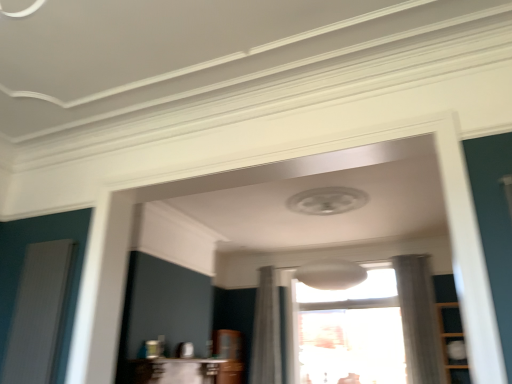
Describe the element at coordinates (419, 319) in the screenshot. This screenshot has width=512, height=384. I see `white sheer curtain at right, arranged as the second curtain when viewed from the left` at that location.

Identify the location of transparent glass window at center. (370, 329).

This screenshot has width=512, height=384. What are the coordinates of `white sheer curtain at center, which ranks as the second curtain in right-to-left order` in the screenshot? It's located at (268, 330).

The height and width of the screenshot is (384, 512). Identify the location of wooden cabinet at right. (453, 343).

Where is `white ribbed screen door at left`? This screenshot has height=384, width=512. white ribbed screen door at left is located at coordinates (38, 314).

The width and height of the screenshot is (512, 384). Describe the element at coordinates (38, 314) in the screenshot. I see `white ribbed screen door at left` at that location.

The image size is (512, 384). Identify the location of white sheer curtain at right, arranged as the second curtain when viewed from the left. (419, 319).

Is white sheer curtain at center, marked as the first curtain in a left-to-right arrangement, at the left side of wooden cabinet at right?

Correct, you'll find white sheer curtain at center, marked as the first curtain in a left-to-right arrangement, to the left of wooden cabinet at right.

Is white sheer curtain at center, which ranks as the second curtain in right-to-left order, directly adjacent to wooden cabinet at right?

There is a gap between white sheer curtain at center, which ranks as the second curtain in right-to-left order, and wooden cabinet at right.

Is white sheer curtain at center, which ranks as the second curtain in right-to-left order, closer to camera compared to wooden cabinet at right?

No, white sheer curtain at center, which ranks as the second curtain in right-to-left order, is further to the viewer.

From a real-world perspective, is white ribbed screen door at left beneath white sheer curtain at right, which is the first curtain in right-to-left order?

Indeed, from a real-world perspective, white ribbed screen door at left is positioned beneath white sheer curtain at right, which is the first curtain in right-to-left order.

Which object is closer to the camera taking this photo, white ribbed screen door at left or white sheer curtain at right, arranged as the second curtain when viewed from the left?

white ribbed screen door at left is more forward.

Is white ribbed screen door at left aimed at white sheer curtain at right, arranged as the second curtain when viewed from the left?

No, white ribbed screen door at left is not aimed at white sheer curtain at right, arranged as the second curtain when viewed from the left.

Is white ribbed screen door at left facing away from white sheer curtain at center, marked as the first curtain in a left-to-right arrangement?

That's right, white ribbed screen door at left is facing away from white sheer curtain at center, marked as the first curtain in a left-to-right arrangement.

Considering the relative positions of white ribbed screen door at left and white sheer curtain at center, which ranks as the second curtain in right-to-left order, in the image provided, is white ribbed screen door at left to the left or to the right of white sheer curtain at center, which ranks as the second curtain in right-to-left order,?

From the image, it's evident that white ribbed screen door at left is to the left of white sheer curtain at center, which ranks as the second curtain in right-to-left order.

From the image's perspective, would you say white ribbed screen door at left is positioned over white sheer curtain at center, marked as the first curtain in a left-to-right arrangement?

Indeed, from the image's perspective, white ribbed screen door at left is shown above white sheer curtain at center, marked as the first curtain in a left-to-right arrangement.

Are white ribbed screen door at left and white sheer curtain at center, which ranks as the second curtain in right-to-left order, making contact?

They are not placed beside each other.

How many degrees apart are the facing directions of wooden cabinet at right and white sheer curtain at right, arranged as the second curtain when viewed from the left?

wooden cabinet at right and white sheer curtain at right, arranged as the second curtain when viewed from the left, are facing 2.38 degrees away from each other.

Can you confirm if wooden cabinet at right is positioned to the left of white sheer curtain at right, arranged as the second curtain when viewed from the left?

In fact, wooden cabinet at right is to the right of white sheer curtain at right, arranged as the second curtain when viewed from the left.

Considering the relative sizes of wooden cabinet at right and white sheer curtain at right, arranged as the second curtain when viewed from the left, in the image provided, is wooden cabinet at right thinner than white sheer curtain at right, arranged as the second curtain when viewed from the left,?

No, wooden cabinet at right is not thinner than white sheer curtain at right, arranged as the second curtain when viewed from the left.

Is wooden cabinet at right facing away from white sheer curtain at right, which is the first curtain in right-to-left order?

No.

Does white sheer curtain at right, arranged as the second curtain when viewed from the left, turn towards transparent glass window at center?

No, white sheer curtain at right, arranged as the second curtain when viewed from the left, is not facing towards transparent glass window at center.

Considering the sizes of objects white sheer curtain at right, which is the first curtain in right-to-left order, and transparent glass window at center in the image provided, who is smaller, white sheer curtain at right, which is the first curtain in right-to-left order, or transparent glass window at center?

white sheer curtain at right, which is the first curtain in right-to-left order.

Considering the sizes of white sheer curtain at right, which is the first curtain in right-to-left order, and transparent glass window at center in the image, is white sheer curtain at right, which is the first curtain in right-to-left order, taller or shorter than transparent glass window at center?

In the image, white sheer curtain at right, which is the first curtain in right-to-left order, appears to be taller than transparent glass window at center.

Considering the positions of objects white sheer curtain at right, arranged as the second curtain when viewed from the left, and transparent glass window at center in the image provided, who is behind, white sheer curtain at right, arranged as the second curtain when viewed from the left, or transparent glass window at center?

transparent glass window at center.

Is point (406, 261) farther from camera compared to point (22, 281)?

Yes, it is.

Is white sheer curtain at right, arranged as the second curtain when viewed from the left, oriented away from white ribbed screen door at left?

That's not correct — white sheer curtain at right, arranged as the second curtain when viewed from the left, is not looking away from white ribbed screen door at left.

Measure the distance from white sheer curtain at right, arranged as the second curtain when viewed from the left, to white ribbed screen door at left.

A distance of 4.69 meters exists between white sheer curtain at right, arranged as the second curtain when viewed from the left, and white ribbed screen door at left.

Who is shorter, white sheer curtain at right, arranged as the second curtain when viewed from the left, or white ribbed screen door at left?

Standing shorter between the two is white ribbed screen door at left.

Is white sheer curtain at center, marked as the first curtain in a left-to-right arrangement, positioned with its back to white ribbed screen door at left?

No.

Can you see white sheer curtain at center, marked as the first curtain in a left-to-right arrangement, touching white ribbed screen door at left?

No, white sheer curtain at center, marked as the first curtain in a left-to-right arrangement, is not next to white ribbed screen door at left.

From a real-world perspective, who is located lower, white sheer curtain at center, marked as the first curtain in a left-to-right arrangement, or white ribbed screen door at left?

From a 3D spatial view, white ribbed screen door at left is below.

Which is closer, (261, 355) or (57, 312)?

The point (57, 312) is closer to the camera.

This screenshot has width=512, height=384. I want to click on cabinetry that is under the white sheer curtain at center, marked as the first curtain in a left-to-right arrangement (from a real-world perspective), so click(453, 343).

From the white ribbed screen door at left, count 2nd curtain to the right and point to it. Please provide its 2D coordinates.

[(419, 319)]

Consider the image. Estimate the real-world distances between objects in this image. Which object is closer to white sheer curtain at center, which ranks as the second curtain in right-to-left order, white ribbed screen door at left or white sheer curtain at right, arranged as the second curtain when viewed from the left?

white sheer curtain at right, arranged as the second curtain when viewed from the left, is positioned closer to the anchor white sheer curtain at center, which ranks as the second curtain in right-to-left order.

Looking at the image, which one is located closer to white sheer curtain at center, marked as the first curtain in a left-to-right arrangement, white ribbed screen door at left or wooden cabinet at right?

wooden cabinet at right lies closer to white sheer curtain at center, marked as the first curtain in a left-to-right arrangement, than the other object.

When comparing their distances from white sheer curtain at right, arranged as the second curtain when viewed from the left, does white sheer curtain at center, marked as the first curtain in a left-to-right arrangement, or white ribbed screen door at left seem further?

white ribbed screen door at left is further to white sheer curtain at right, arranged as the second curtain when viewed from the left.

Estimate the real-world distances between objects in this image. Which object is closer to white ribbed screen door at left, wooden cabinet at right or white sheer curtain at right, which is the first curtain in right-to-left order?

white sheer curtain at right, which is the first curtain in right-to-left order, lies closer to white ribbed screen door at left than the other object.

When comparing their distances from white sheer curtain at right, which is the first curtain in right-to-left order, does wooden cabinet at right or white ribbed screen door at left seem closer?

wooden cabinet at right is positioned closer to the anchor white sheer curtain at right, which is the first curtain in right-to-left order.

Estimate the real-world distances between objects in this image. Which object is further from transparent glass window at center, white ribbed screen door at left or white sheer curtain at right, arranged as the second curtain when viewed from the left?

Among the two, white ribbed screen door at left is located further to transparent glass window at center.

Considering their positions, is white ribbed screen door at left positioned further to white sheer curtain at right, arranged as the second curtain when viewed from the left, than transparent glass window at center?

Among the two, white ribbed screen door at left is located further to white sheer curtain at right, arranged as the second curtain when viewed from the left.

Considering their positions, is transparent glass window at center positioned closer to white sheer curtain at right, arranged as the second curtain when viewed from the left, than white sheer curtain at center, marked as the first curtain in a left-to-right arrangement?

transparent glass window at center.

Where is `window between white sheer curtain at center, which ranks as the second curtain in right-to-left order, and wooden cabinet at right`? The height and width of the screenshot is (384, 512). window between white sheer curtain at center, which ranks as the second curtain in right-to-left order, and wooden cabinet at right is located at coordinates (370, 329).

I want to click on window situated between white ribbed screen door at left and white sheer curtain at right, arranged as the second curtain when viewed from the left, from left to right, so click(x=370, y=329).

Where is `curtain situated between white ribbed screen door at left and white sheer curtain at right, which is the first curtain in right-to-left order, from left to right`? The height and width of the screenshot is (384, 512). curtain situated between white ribbed screen door at left and white sheer curtain at right, which is the first curtain in right-to-left order, from left to right is located at coordinates (268, 330).

In order to click on window located between white ribbed screen door at left and white sheer curtain at center, marked as the first curtain in a left-to-right arrangement, in the depth direction in this screenshot , I will do `click(370, 329)`.